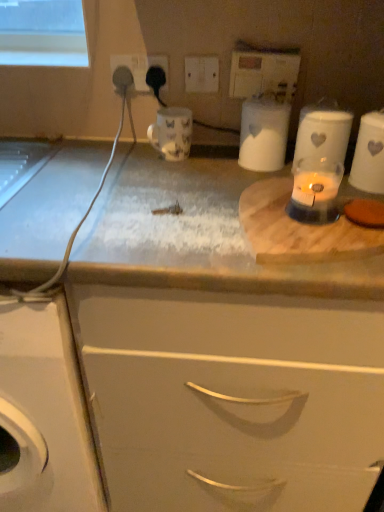
The height and width of the screenshot is (512, 384). In order to click on free space above white matte cabinet at center (from a real-world perspective) in this screenshot , I will do `click(209, 198)`.